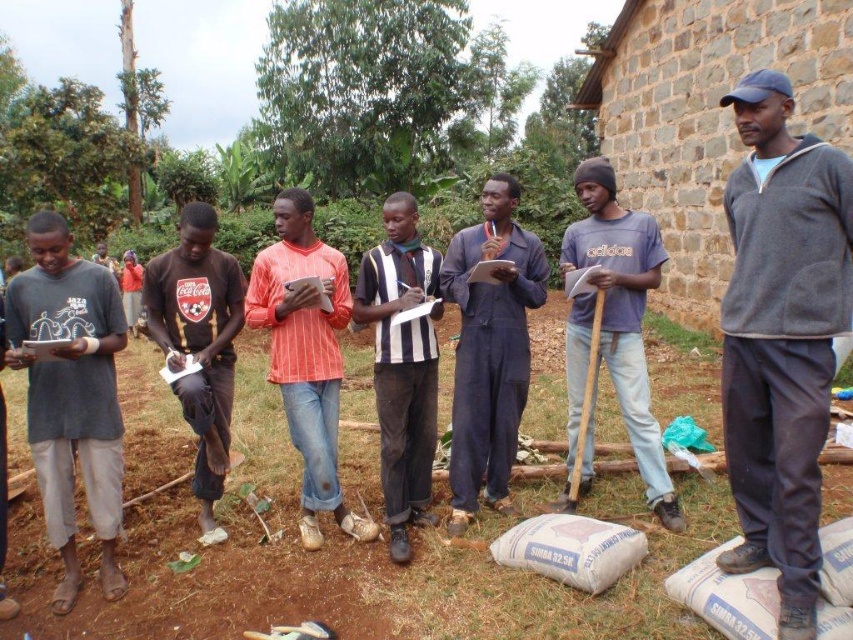
Is point (425, 397) farther from viewer compared to point (206, 353)?

That is True.

Between point (401, 273) and point (195, 332), which one is positioned in front?

Point (195, 332) is more forward.

Where is `striped jersey at center`? The width and height of the screenshot is (853, 640). striped jersey at center is located at coordinates (402, 365).

Where is `striped jersey at center`? This screenshot has height=640, width=853. striped jersey at center is located at coordinates (402, 365).

Does gray fleece jacket at center have a smaller size compared to orange striped shirt at center?

Yes.

Between point (749, 243) and point (258, 296), which one is positioned in front?

Point (749, 243) is more forward.

Is point (851, 253) farther from camera compared to point (289, 413)?

No, (851, 253) is in front of (289, 413).

Identify the location of gray fleece jacket at center. The height and width of the screenshot is (640, 853). (781, 337).

Who is positioned more to the right, orange striped shirt at center or striped jersey at center?

striped jersey at center is more to the right.

Does orange striped shirt at center appear under striped jersey at center?

Incorrect, orange striped shirt at center is not positioned below striped jersey at center.

In order to click on orange striped shirt at center in this screenshot , I will do `click(306, 353)`.